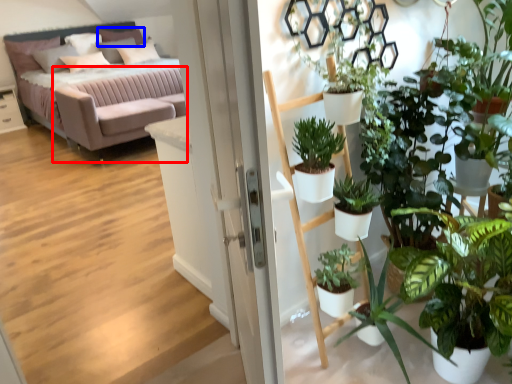
Question: Which point is further to the camera, couch (highlighted by a red box) or pillow (highlighted by a blue box)?

Choices:
 (A) couch
 (B) pillow

Answer: (B)